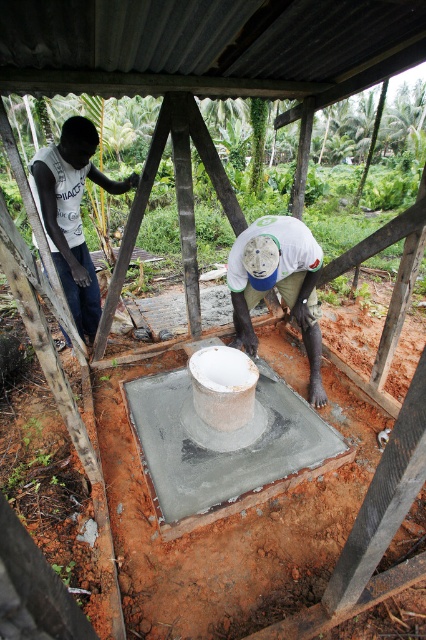
Is matte white shirt at left behind white matte concrete at center?

Yes, matte white shirt at left is behind white matte concrete at center.

Where is `matte white shirt at left`? This screenshot has height=640, width=426. matte white shirt at left is located at coordinates (71, 214).

Is point (74, 241) closer to viewer compared to point (307, 269)?

No, (74, 241) is behind (307, 269).

You are a GUI agent. You are given a task and a screenshot of the screen. Output one action in this format:
    pyautogui.click(x=<x>, y=<y>)
    Task: Click on the matte white shirt at left
    The width and height of the screenshot is (426, 640).
    Given the screenshot: What is the action you would take?
    [71, 214]